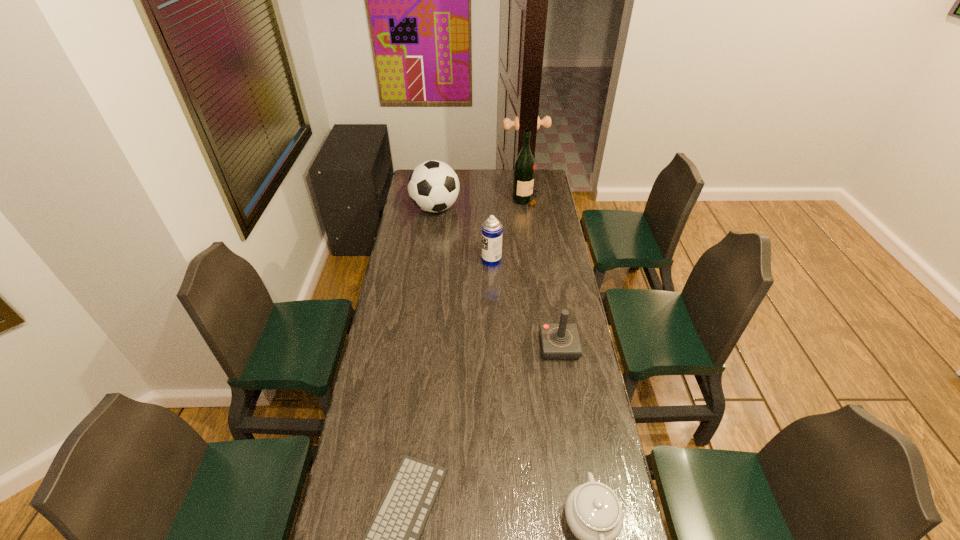
Find the location of a particular element. empty space between the wine bottle and the third nearest object is located at coordinates (542, 274).

I want to click on vacant area between the tallest object and the fourth farthest object, so click(x=542, y=274).

Image resolution: width=960 pixels, height=540 pixels. Identify the location of the second closest object to the shortest object. (560, 341).

Locate an element on the screen. This screenshot has width=960, height=540. the second closest object to the second shortest object is located at coordinates (560, 341).